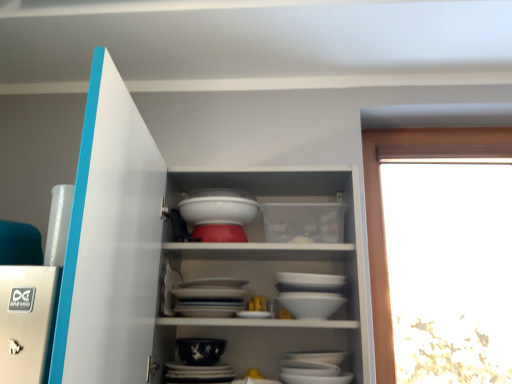
Question: Should I look upward or downward to see white glossy cupboard at center?

Choices:
 (A) up
 (B) down

Answer: (B)

Question: Is white glossy cupboard at center wider than white glossy bowl at center?

Choices:
 (A) no
 (B) yes

Answer: (B)

Question: Is the position of white glossy cupboard at center more distant than that of white glossy bowl at center?

Choices:
 (A) no
 (B) yes

Answer: (A)

Question: From a real-world perspective, does white glossy cupboard at center stand above white glossy bowl at center?

Choices:
 (A) no
 (B) yes

Answer: (A)

Question: Considering the relative sizes of white glossy cupboard at center and white glossy bowl at center in the image provided, is white glossy cupboard at center thinner than white glossy bowl at center?

Choices:
 (A) no
 (B) yes

Answer: (A)

Question: Is white glossy cupboard at center directly adjacent to white glossy bowl at center?

Choices:
 (A) no
 (B) yes

Answer: (A)

Question: Considering the relative sizes of white glossy cupboard at center and white glossy bowl at center in the image provided, is white glossy cupboard at center bigger than white glossy bowl at center?

Choices:
 (A) no
 (B) yes

Answer: (B)

Question: Does dark blue porcelain bowl at center appear on the right side of white glossy bowl at center?

Choices:
 (A) no
 (B) yes

Answer: (A)

Question: Does dark blue porcelain bowl at center have a lesser width compared to white glossy bowl at center?

Choices:
 (A) no
 (B) yes

Answer: (B)

Question: From a real-world perspective, is dark blue porcelain bowl at center positioned over white glossy bowl at center based on gravity?

Choices:
 (A) no
 (B) yes

Answer: (A)

Question: Is dark blue porcelain bowl at center far away from white glossy bowl at center?

Choices:
 (A) no
 (B) yes

Answer: (A)

Question: Is dark blue porcelain bowl at center further to camera compared to white glossy bowl at center?

Choices:
 (A) no
 (B) yes

Answer: (A)

Question: Is white glossy bowl at center completely or partially inside dark blue porcelain bowl at center?

Choices:
 (A) yes
 (B) no

Answer: (B)

Question: Is dark blue porcelain bowl at center positioned beyond the bounds of white glossy cupboard at center?

Choices:
 (A) no
 (B) yes

Answer: (A)